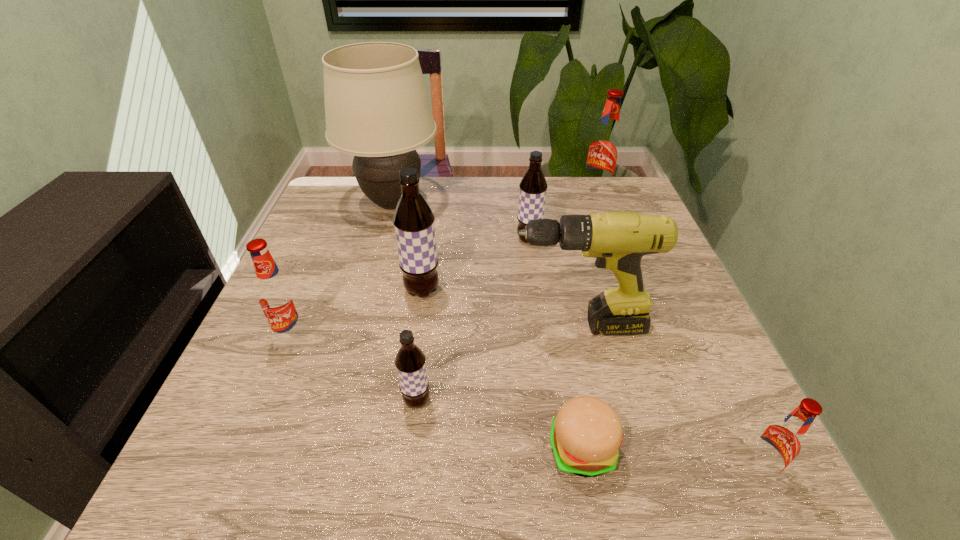
At what (x,y) coordinates should I click in order to perform the action: click on free space between the second farthest root beer and the seventh farthest object. Please return your answer as a coordinate pair (x, y). This screenshot has width=960, height=540. Looking at the image, I should click on (473, 320).

Image resolution: width=960 pixels, height=540 pixels. Find the location of `free space that is in between the second smallest red root beer and the tallest object`. free space that is in between the second smallest red root beer and the tallest object is located at coordinates (344, 270).

Where is `the third closest object to the biggest red root beer`? The image size is (960, 540). the third closest object to the biggest red root beer is located at coordinates (618, 239).

Where is `the seventh closest object to the nearest brown root beer`? the seventh closest object to the nearest brown root beer is located at coordinates (780, 442).

Find the location of a particular element. The width and height of the screenshot is (960, 540). the fifth closest root beer to the second farthest brown root beer is located at coordinates (780, 442).

Locate an element on the screen. root beer that stands as the sixth closest to the tallest object is located at coordinates tap(780, 442).

The image size is (960, 540). Find the location of `red root beer that is the nearest to the hamburger`. red root beer that is the nearest to the hamburger is located at coordinates (780, 442).

Where is `the closest red root beer to the fourth farthest object`? the closest red root beer to the fourth farthest object is located at coordinates (277, 296).

Identify the location of brown root beer that is the second nearest to the second biggest brown root beer. (410, 361).

Find the location of `brown root beer that is the closest to the hamburger`. brown root beer that is the closest to the hamburger is located at coordinates (410, 361).